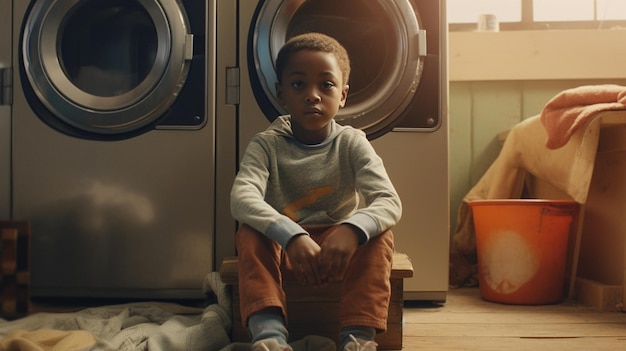
Find the location of `bucket`. bucket is located at coordinates (525, 235).